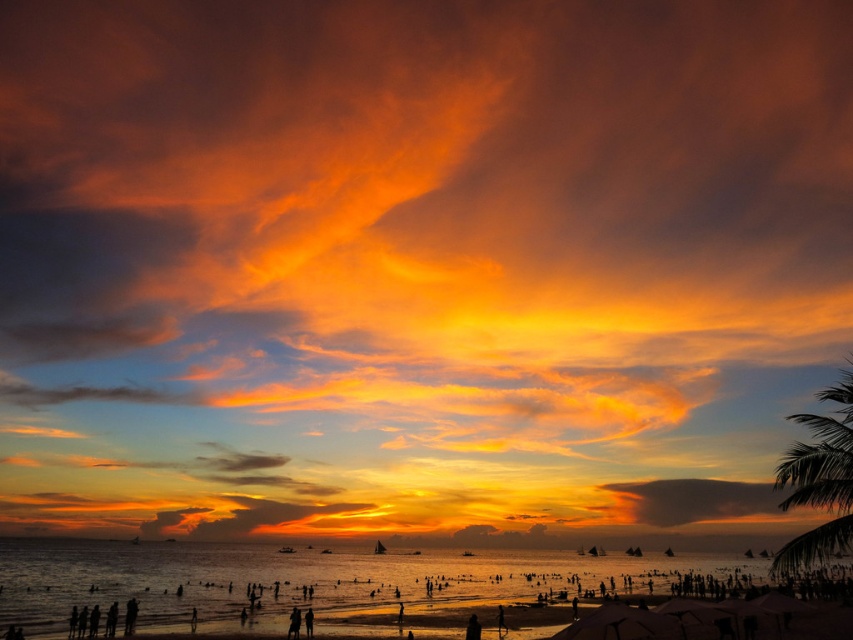
You are a photographer standing on the beach during the sunset. You want to capture a photo where the translucent golden water at center and the matte orange cloud at lower right are both visible. Based on their positions, which object will appear closer to the horizon in the photo?

The translucent golden water at center is positioned over the matte orange cloud at lower right, so the matte orange cloud at lower right will appear closer to the horizon in the photo.

You are a photographer trying to capture the sunset. You notice the green leafy palm tree at right and the translucent orange cloud at center. Which object should you focus on if you want to highlight something larger in your photo?

The green leafy palm tree at right is larger in size than the translucent orange cloud at center, so you should focus on the green leafy palm tree at right to highlight a larger object in your photo.